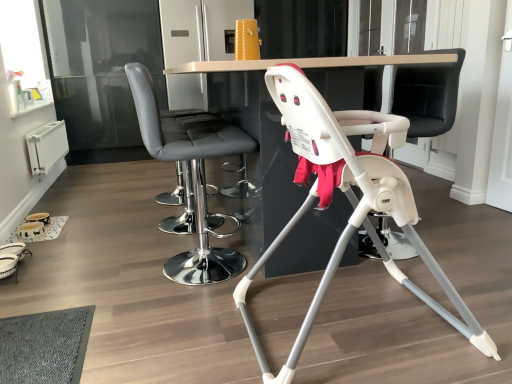
You are a GUI agent. You are given a task and a screenshot of the screen. Output one action in this format:
    pyautogui.click(x=<x>, y=<y>)
    Task: Click on the free space in front of matte gray bar stool at center, which ranks as the first chair in left-to-right order
    
    Given the screenshot: What is the action you would take?
    pyautogui.click(x=174, y=315)